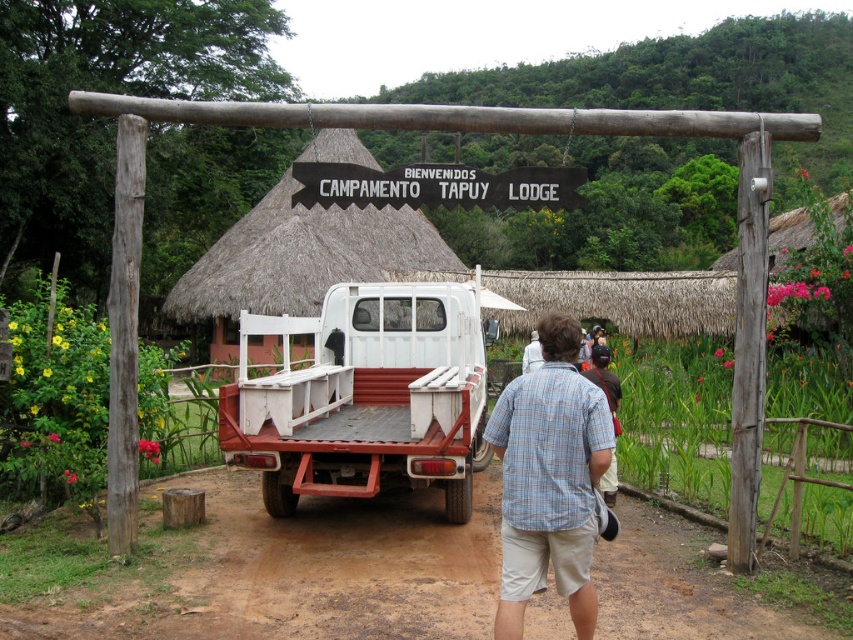
You are a hiker who just arrived at the Campamento Tapuy Lodge. You need to determine which object is taller between the brown dirt track at center and the thatched straw hut at center. Based on the scene, which one is taller?

The thatched straw hut at center is taller than the brown dirt track at center.

You are standing at the entrance of Campamento Tapuy Lodge under the wooden archway. You need to park your vehicle near the white matte truck at center. According to the coordinates provided, where should you position your vehicle relative to the existing truck?

The white matte truck at center is located at point coordinates (x=364, y=396). To park your vehicle near it, you should position your vehicle at the same or adjacent coordinates relative to the truck.